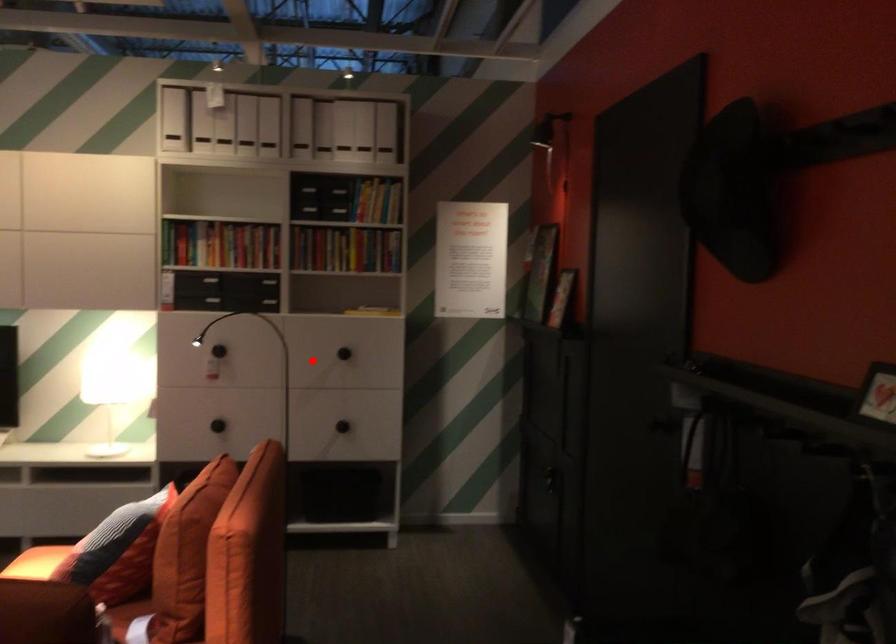
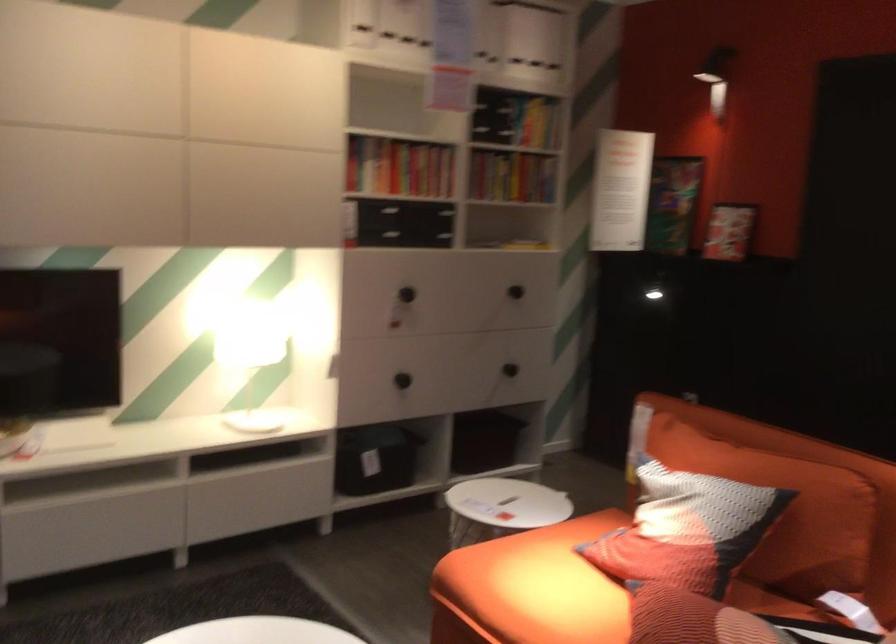
Where in the second image is the point corresponding to the highlighted location from the first image?

(514, 292)